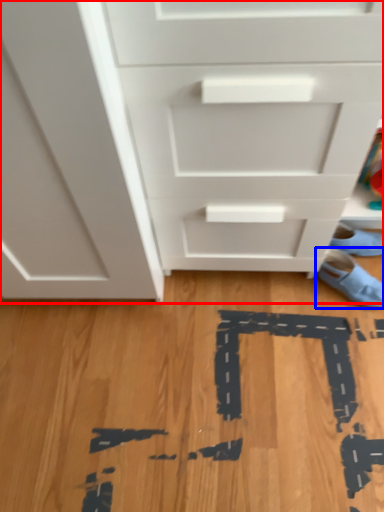
Question: Which point is closer to the camera, chest of drawers (highlighted by a red box) or footwear (highlighted by a blue box)?

Choices:
 (A) chest of drawers
 (B) footwear

Answer: (A)